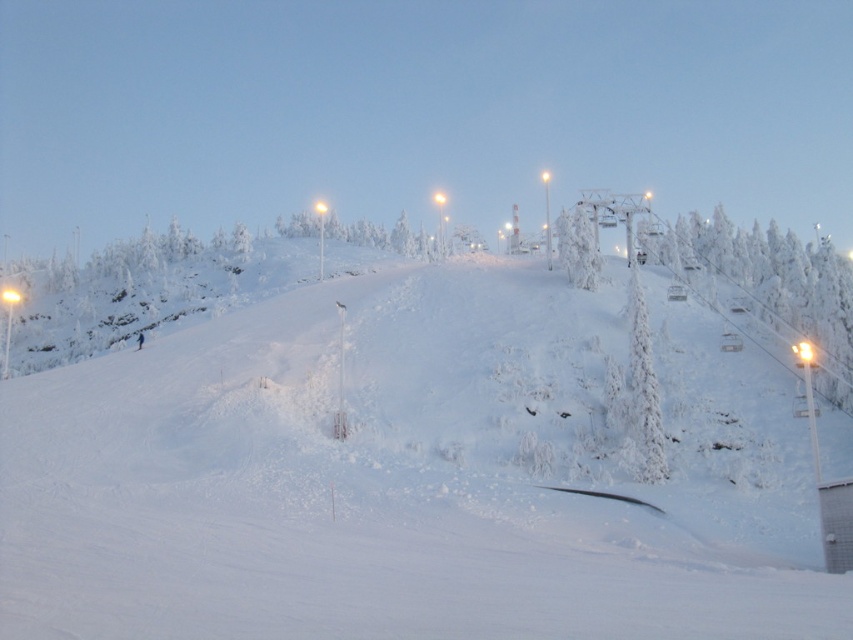
Can you confirm if white snow ski slope at center is shorter than blue fabric snowboarder at center?

No.

Does point (83, 458) come farther from viewer compared to point (142, 333)?

No.

Locate an element on the screen. The image size is (853, 640). white snow ski slope at center is located at coordinates (404, 477).

Does white frosty tree at upper right have a smaller size compared to blue fabric snowboarder at center?

No, white frosty tree at upper right is not smaller than blue fabric snowboarder at center.

Is white frosty tree at upper right shorter than blue fabric snowboarder at center?

No, white frosty tree at upper right is not shorter than blue fabric snowboarder at center.

Is point (706, 260) positioned behind point (142, 336)?

Yes, point (706, 260) is farther from viewer.

This screenshot has height=640, width=853. In order to click on white frosty tree at upper right in this screenshot , I will do `click(773, 284)`.

Find the location of `white frosty tree at upper right`. white frosty tree at upper right is located at coordinates (773, 284).

Does white frosty tree at upper right have a greater height compared to white frosty tree at upper center?

Yes, white frosty tree at upper right is taller than white frosty tree at upper center.

I want to click on white frosty tree at upper right, so click(773, 284).

Where is `white frosty tree at upper right`? This screenshot has height=640, width=853. white frosty tree at upper right is located at coordinates (773, 284).